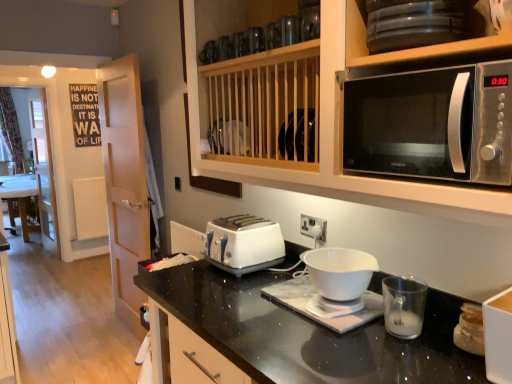
Question: Does point (273, 243) appear closer or farther from the camera than point (128, 228)?

Choices:
 (A) farther
 (B) closer

Answer: (B)

Question: From their relative heights in the image, would you say white plastic toaster at center is taller or shorter than white glossy door at left?

Choices:
 (A) short
 (B) tall

Answer: (A)

Question: Estimate the real-world distances between objects in this image. Which object is farther from the white plastic mixing bowl at center?

Choices:
 (A) white glossy door at left
 (B) white glossy table at left
 (C) white glossy bowl at center, the 2th appliance positioned from the front
 (D) satin silver microwave at upper right
 (E) satin silver microwave at upper right

Answer: (B)

Question: Based on their relative distances, which object is farther from the white glossy bowl at center, which is the 1th appliance in back-to-front order?

Choices:
 (A) clear glass measuring cup at right, marked as the first appliance in a front-to-back arrangement
 (B) satin silver microwave at upper right
 (C) white plastic toaster at center
 (D) satin silver microwave at upper right
 (E) white plastic mixing bowl at center

Answer: (D)